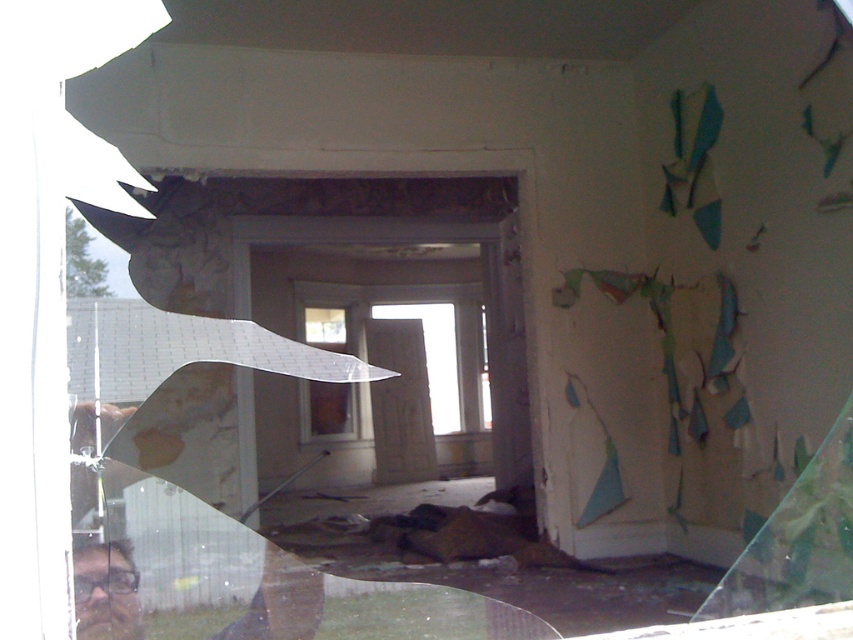
Question: Which point is closer to the camera?

Choices:
 (A) transparent glass window at center
 (B) clear glass window at center

Answer: (B)

Question: Is clear glass window at center below transparent glass window at center?

Choices:
 (A) no
 (B) yes

Answer: (B)

Question: Does clear glass window at center appear on the right side of transparent glass window at center?

Choices:
 (A) yes
 (B) no

Answer: (B)

Question: Is clear glass window at center below transparent glass window at center?

Choices:
 (A) no
 (B) yes

Answer: (B)